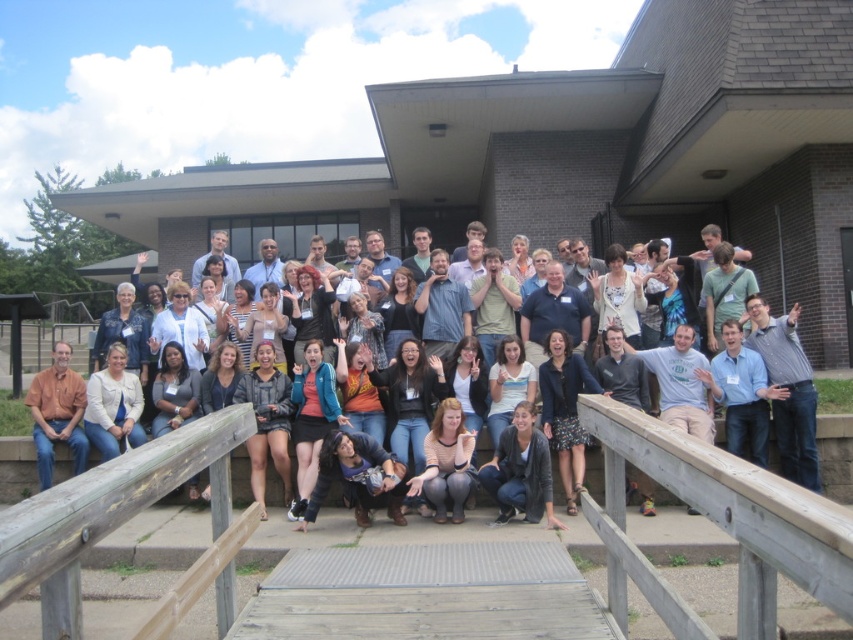
Can you confirm if brown wooden rail at lower center is bigger than matte black jacket at center?

Correct, brown wooden rail at lower center is larger in size than matte black jacket at center.

Does point (805, 528) come in front of point (593, 282)?

Yes, point (805, 528) is in front of point (593, 282).

Where is `brown wooden rail at lower center`? This screenshot has width=853, height=640. brown wooden rail at lower center is located at coordinates (712, 492).

From the picture: Can you confirm if brown wooden rail at lower center is positioned below orange shirt at left?

Indeed, brown wooden rail at lower center is positioned under orange shirt at left.

Image resolution: width=853 pixels, height=640 pixels. What do you see at coordinates (712, 492) in the screenshot?
I see `brown wooden rail at lower center` at bounding box center [712, 492].

Find the location of `brown wooden rail at lower center`. brown wooden rail at lower center is located at coordinates (712, 492).

Who is taller, matte black jacket at center or orange shirt at left?

matte black jacket at center

Does point (753, 320) lie behind point (67, 344)?

That is False.

The image size is (853, 640). What are the coordinates of `matte black jacket at center` in the screenshot? It's located at [x=769, y=388].